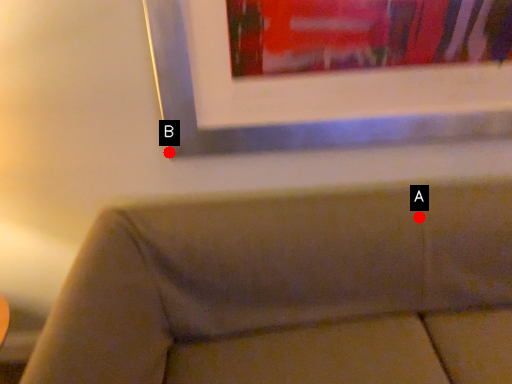
Question: Two points are circled on the image, labeled by A and B beside each circle. Which point is closer to the camera taking this photo?

Choices:
 (A) A is closer
 (B) B is closer

Answer: (A)